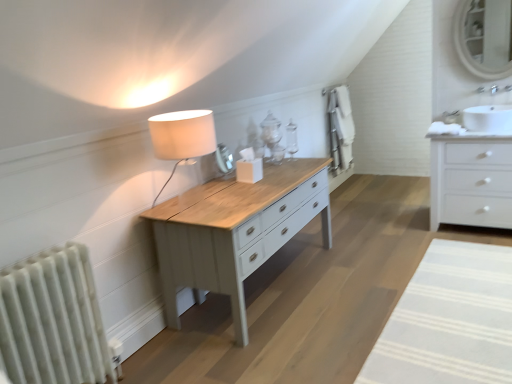
Locate an element on the screen. The image size is (512, 384). vacant space to the left of white glossy chest of drawers at right is located at coordinates (416, 231).